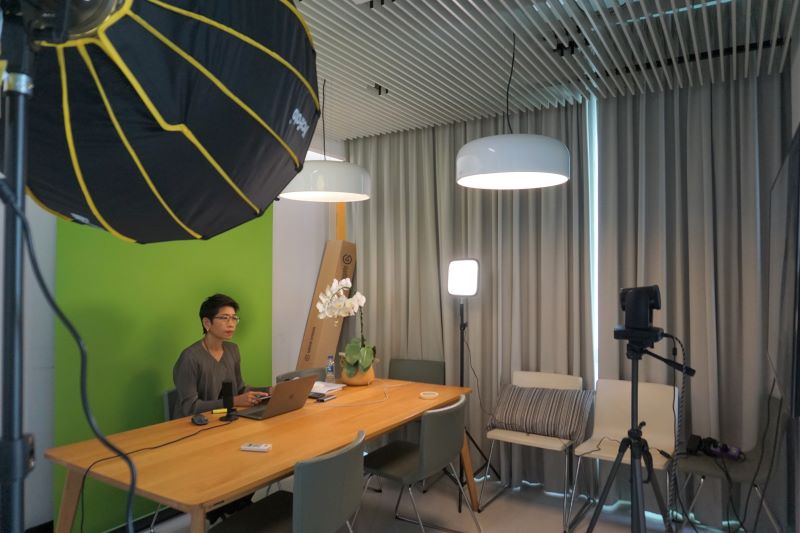
You are a GUI agent. You are given a task and a screenshot of the screen. Output one action in this format:
    pyautogui.click(x=<x>, y=<y>)
    Task: Click on the pillow
    
    Given the screenshot: What is the action you would take?
    point(553,426)